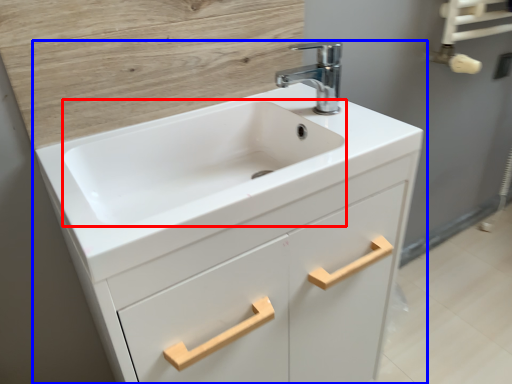
Question: Among these objects, which one is farthest to the camera, sink (highlighted by a red box) or bathroom cabinet (highlighted by a blue box)?

Choices:
 (A) sink
 (B) bathroom cabinet

Answer: (A)